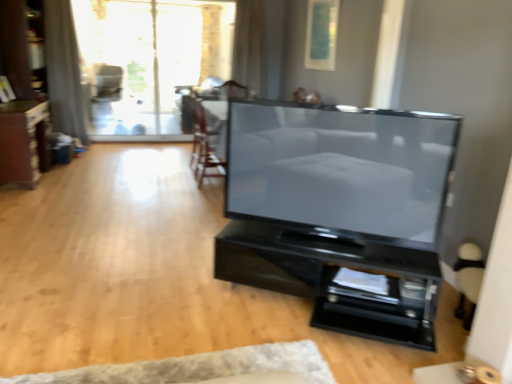
Image resolution: width=512 pixels, height=384 pixels. Describe the element at coordinates (336, 278) in the screenshot. I see `black glossy tv stand at center, which ranks as the first furniture in right-to-left order` at that location.

Identify the location of white sheer curtain at upper center, placed as the 2th curtain when sorted from left to right. (251, 46).

In order to click on matte brown cabinet at left, which is the first furniture in left-to-right order in this screenshot , I will do `click(24, 142)`.

This screenshot has width=512, height=384. In order to click on matte black tv at center in this screenshot , I will do `click(341, 170)`.

Is point (79, 89) positioned behind point (213, 137)?

Yes, it is behind point (213, 137).

Is there a large distance between gray fabric curtain at upper left, which appears as the 1th curtain when viewed from the left, and dark brown leather armchair at center, the second armchair when ordered from left to right?

Absolutely, gray fabric curtain at upper left, which appears as the 1th curtain when viewed from the left, is distant from dark brown leather armchair at center, the second armchair when ordered from left to right.

From a real-world perspective, which object rests below the other?

In real-world perspective, dark brown leather armchair at center, positioned as the 2th armchair in back-to-front order, is lower.

Considering the sizes of objects matte black tv at center and transparent glass door at upper center in the image provided, who is smaller, matte black tv at center or transparent glass door at upper center?

With smaller size is matte black tv at center.

Considering the relative sizes of matte black tv at center and transparent glass door at upper center in the image provided, is matte black tv at center taller than transparent glass door at upper center?

Incorrect, the height of matte black tv at center is not larger of that of transparent glass door at upper center.

Does matte black tv at center contain transparent glass door at upper center?

No, transparent glass door at upper center is not inside matte black tv at center.

Locate an element on the screen. television that is below the transparent glass door at upper center (from the image's perspective) is located at coordinates (341, 170).

In the scene shown: Which is more to the left, transparent glass door at upper center or dark brown leather armchair at center, positioned as the 2th armchair in back-to-front order?

Positioned to the left is transparent glass door at upper center.

Choose the correct answer: Is transparent glass door at upper center inside dark brown leather armchair at center, which ranks as the 1th armchair in right-to-left order, or outside it?

transparent glass door at upper center lies outside dark brown leather armchair at center, which ranks as the 1th armchair in right-to-left order.

The height and width of the screenshot is (384, 512). I want to click on armchair to the right of transparent glass door at upper center, so click(x=220, y=111).

From the image's perspective, does transparent glass door at upper center appear lower than dark brown leather armchair at center, the second armchair when ordered from left to right?

Actually, transparent glass door at upper center appears above dark brown leather armchair at center, the second armchair when ordered from left to right, in the image.

Would you consider dark brown leather armchair at center, positioned as the 2th armchair in back-to-front order, to be distant from matte black armchair at upper center, positioned as the second armchair in bottom-to-top order?

dark brown leather armchair at center, positioned as the 2th armchair in back-to-front order, is positioned a significant distance from matte black armchair at upper center, positioned as the second armchair in bottom-to-top order.

Find the location of `armchair behind the dark brown leather armchair at center, which ranks as the 1th armchair in front-to-back order`. armchair behind the dark brown leather armchair at center, which ranks as the 1th armchair in front-to-back order is located at coordinates (106, 91).

From a real-world perspective, is dark brown leather armchair at center, which ranks as the 1th armchair in front-to-back order, physically below matte black armchair at upper center, marked as the 2th armchair in a right-to-left arrangement?

Indeed, from a real-world perspective, dark brown leather armchair at center, which ranks as the 1th armchair in front-to-back order, is positioned beneath matte black armchair at upper center, marked as the 2th armchair in a right-to-left arrangement.

Between dark brown leather armchair at center, marked as the 1th armchair in a bottom-to-top arrangement, and matte black armchair at upper center, the first armchair from the left, which one has smaller width?

dark brown leather armchair at center, marked as the 1th armchair in a bottom-to-top arrangement.

Which of these two, black glossy tv stand at center, the 2th furniture viewed from the back, or white textured rug at lower center, is wider?

black glossy tv stand at center, the 2th furniture viewed from the back.

Considering the relative positions of black glossy tv stand at center, which is counted as the first furniture, starting from the bottom, and white textured rug at lower center in the image provided, is black glossy tv stand at center, which is counted as the first furniture, starting from the bottom, to the left or to the right of white textured rug at lower center?

Based on their positions, black glossy tv stand at center, which is counted as the first furniture, starting from the bottom, is located to the right of white textured rug at lower center.

From a real-world perspective, which is physically below, black glossy tv stand at center, the 2th furniture viewed from the back, or white textured rug at lower center?

white textured rug at lower center is physically lower.

Considering the relative sizes of black glossy tv stand at center, which is the 2th furniture from left to right, and white textured rug at lower center in the image provided, is black glossy tv stand at center, which is the 2th furniture from left to right, shorter than white textured rug at lower center?

In fact, black glossy tv stand at center, which is the 2th furniture from left to right, may be taller than white textured rug at lower center.

The width and height of the screenshot is (512, 384). What are the coordinates of `armchair in front of the white sheer curtain at upper center, which is the 1th curtain in right-to-left order` in the screenshot? It's located at (220, 111).

From a real-world perspective, is dark brown leather armchair at center, which ranks as the 1th armchair in right-to-left order, above or below white sheer curtain at upper center, which is the 1th curtain in right-to-left order?

dark brown leather armchair at center, which ranks as the 1th armchair in right-to-left order, is situated lower than white sheer curtain at upper center, which is the 1th curtain in right-to-left order, in the real world.

Is there a large distance between dark brown leather armchair at center, which ranks as the 1th armchair in right-to-left order, and white sheer curtain at upper center, placed as the 2th curtain when sorted from left to right?

Actually, dark brown leather armchair at center, which ranks as the 1th armchair in right-to-left order, and white sheer curtain at upper center, placed as the 2th curtain when sorted from left to right, are a little close together.

Is white sheer curtain at upper center, placed as the 2th curtain when sorted from left to right, at the back of dark brown leather armchair at center, marked as the 1th armchair in a bottom-to-top arrangement?

dark brown leather armchair at center, marked as the 1th armchair in a bottom-to-top arrangement, does not have its back to white sheer curtain at upper center, placed as the 2th curtain when sorted from left to right.

From a real-world perspective, is dark brown wood dresser at left positioned above or below gray fabric curtain at upper left, placed as the second curtain when sorted from right to left?

dark brown wood dresser at left is situated higher than gray fabric curtain at upper left, placed as the second curtain when sorted from right to left, in the real world.

In terms of height, does dark brown wood dresser at left look taller or shorter compared to gray fabric curtain at upper left, which appears as the 1th curtain when viewed from the left?

dark brown wood dresser at left is shorter than gray fabric curtain at upper left, which appears as the 1th curtain when viewed from the left.

Which of these two, dark brown wood dresser at left or gray fabric curtain at upper left, placed as the second curtain when sorted from right to left, is wider?

With larger width is dark brown wood dresser at left.

The width and height of the screenshot is (512, 384). I want to click on curtain to the left of dark brown leather armchair at center, the second armchair when ordered from left to right, so click(64, 71).

Locate an element on the screen. The image size is (512, 384). glass door above the matte black tv at center (from the image's perspective) is located at coordinates (149, 61).

Which object lies further to the anchor point matte black tv at center, black glossy tv stand at center, the 2th furniture viewed from the back, or white sheer curtain at upper center, which is the 1th curtain in right-to-left order?

Based on the image, white sheer curtain at upper center, which is the 1th curtain in right-to-left order, appears to be further to matte black tv at center.

Considering their positions, is gray fabric curtain at upper left, which appears as the 1th curtain when viewed from the left, positioned closer to transparent glass door at upper center than matte brown cabinet at left, the 1th furniture from the back?

Based on the image, gray fabric curtain at upper left, which appears as the 1th curtain when viewed from the left, appears to be nearer to transparent glass door at upper center.

Based on their spatial positions, is white textured rug at lower center or white sheer curtain at upper center, placed as the 2th curtain when sorted from left to right, further from matte black armchair at upper center, the first armchair when ordered from top to bottom?

white textured rug at lower center lies further to matte black armchair at upper center, the first armchair when ordered from top to bottom, than the other object.

Considering their positions, is white textured rug at lower center positioned further to matte brown cabinet at left, which is the second furniture in bottom-to-top order, than dark brown wood dresser at left?

white textured rug at lower center lies further to matte brown cabinet at left, which is the second furniture in bottom-to-top order, than the other object.

When comparing their distances from dark brown leather armchair at center, the second armchair from the top, does dark brown wood dresser at left or matte black armchair at upper center, positioned as the second armchair in bottom-to-top order, seem further?

The object further to dark brown leather armchair at center, the second armchair from the top, is dark brown wood dresser at left.

Estimate the real-world distances between objects in this image. Which object is closer to matte black armchair at upper center, the first armchair when ordered from top to bottom, white sheer curtain at upper center, which is the 1th curtain in right-to-left order, or matte black tv at center?

Based on the image, white sheer curtain at upper center, which is the 1th curtain in right-to-left order, appears to be nearer to matte black armchair at upper center, the first armchair when ordered from top to bottom.

Which object lies nearer to the anchor point dark brown leather armchair at center, which ranks as the 1th armchair in front-to-back order, transparent glass door at upper center or gray fabric curtain at upper left, placed as the second curtain when sorted from right to left?

Among the two, transparent glass door at upper center is located nearer to dark brown leather armchair at center, which ranks as the 1th armchair in front-to-back order.

Looking at the image, which one is located further to dark brown leather armchair at center, the second armchair when ordered from left to right, dark brown wood dresser at left or transparent glass door at upper center?

Based on the image, dark brown wood dresser at left appears to be further to dark brown leather armchair at center, the second armchair when ordered from left to right.

At what (x,y) coordinates should I click in order to perform the action: click on curtain between white textured rug at lower center and white sheer curtain at upper center, placed as the 2th curtain when sorted from left to right, from front to back. Please return your answer as a coordinate pair (x, y). Looking at the image, I should click on (64, 71).

Image resolution: width=512 pixels, height=384 pixels. I want to click on curtain between dark brown wood dresser at left and white sheer curtain at upper center, which is the 1th curtain in right-to-left order, in the horizontal direction, so click(x=64, y=71).

You are a GUI agent. You are given a task and a screenshot of the screen. Output one action in this format:
    pyautogui.click(x=<x>, y=<y>)
    Task: Click on the armchair positioned between matte brown cabinet at left, arranged as the first furniture when viewed from the top, and matte black armchair at upper center, the first armchair from the left, from near to far
    This screenshot has height=384, width=512.
    Given the screenshot: What is the action you would take?
    pyautogui.click(x=220, y=111)

What are the coordinates of `curtain between white textured rug at lower center and transparent glass door at upper center in the front-back direction` in the screenshot? It's located at (64, 71).